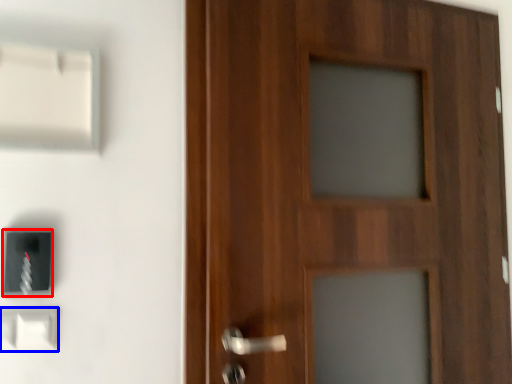
Question: Which of the following is the closest to the observer, light switch (highlighted by a red box) or light switch (highlighted by a blue box)?

Choices:
 (A) light switch
 (B) light switch

Answer: (B)